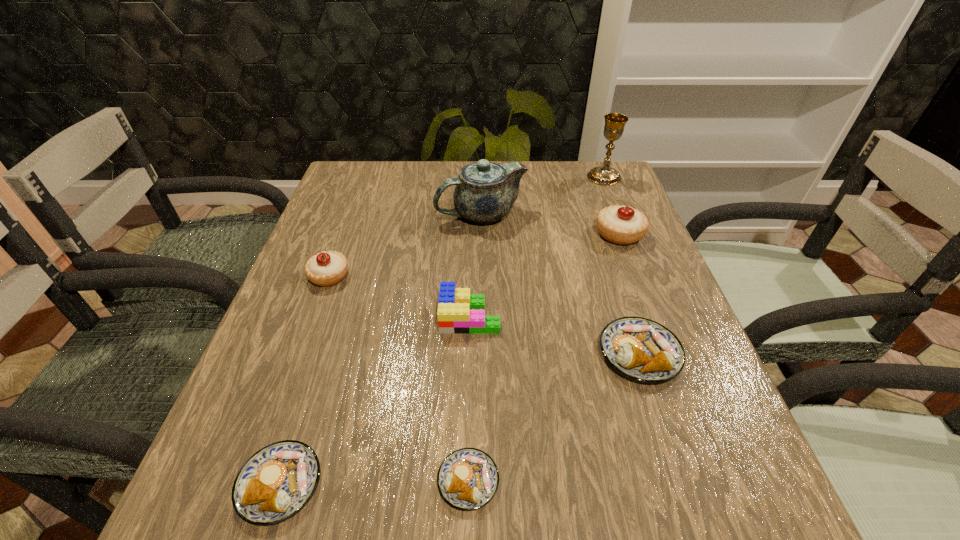
The width and height of the screenshot is (960, 540). In order to click on free region located 0.090m on the back of the third shortest pastry in this screenshot , I will do `click(619, 291)`.

Identify the location of vacant space positioned 0.100m on the back of the fourth tallest pastry. (310, 389).

The height and width of the screenshot is (540, 960). What are the coordinates of `vacant space located 0.140m on the back of the smallest brown pastry` in the screenshot? It's located at (470, 375).

At what (x,y) coordinates should I click in order to perform the action: click on chalice that is at the far edge. Please return your answer as a coordinate pair (x, y). The width and height of the screenshot is (960, 540). Looking at the image, I should click on (614, 126).

Where is `chinaware positioned at the far edge`? chinaware positioned at the far edge is located at coordinates (485, 191).

You are a GUI agent. You are given a task and a screenshot of the screen. Output one action in this format:
    pyautogui.click(x=<x>, y=<y>)
    Task: Click on the chalice located at the right edge
    This screenshot has height=540, width=960.
    Given the screenshot: What is the action you would take?
    pyautogui.click(x=614, y=126)

Where is `object that is at the near left corner`? This screenshot has width=960, height=540. object that is at the near left corner is located at coordinates (277, 481).

Locate an element on the screen. object located at the far right corner is located at coordinates (614, 126).

This screenshot has height=540, width=960. In the image, there is a desktop. In order to click on vacant space at the far edge in this screenshot , I will do `click(521, 187)`.

The width and height of the screenshot is (960, 540). What are the coordinates of `vacant space at the left edge` in the screenshot? It's located at (366, 215).